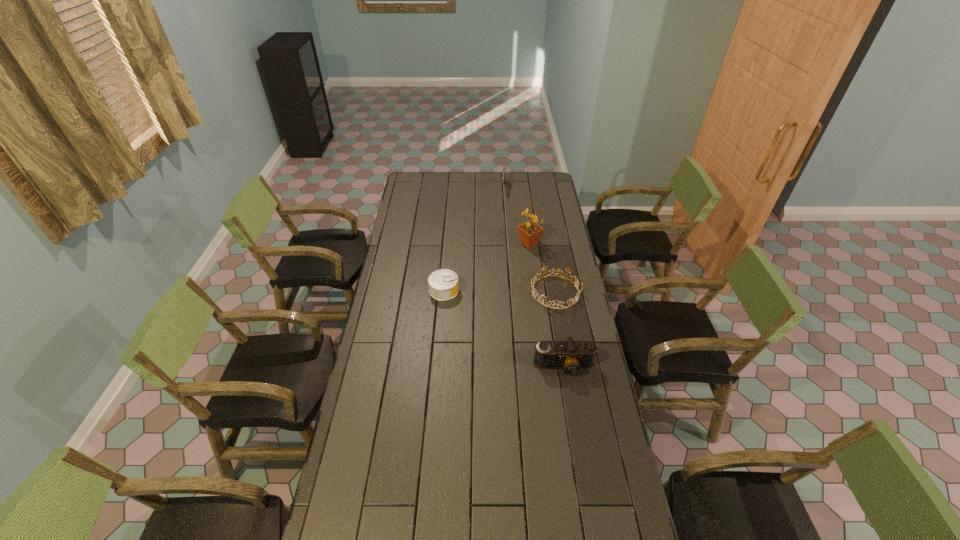
You are a GUI agent. You are given a task and a screenshot of the screen. Output one action in this format:
    pyautogui.click(x=<x>, y=<y>)
    Task: Click on the free region located 0.260m at the barrel of the pistol
    This screenshot has height=540, width=960.
    Given the screenshot: What is the action you would take?
    pyautogui.click(x=501, y=221)

Locate an element on the screen. This screenshot has width=960, height=540. vacant space located at the barrel of the pistol is located at coordinates (501, 222).

This screenshot has width=960, height=540. What are the coordinates of `free space located on the front-facing side of the tiara` in the screenshot? It's located at (513, 340).

Find the location of `blank space located 0.400m on the front-facing side of the tiara`. blank space located 0.400m on the front-facing side of the tiara is located at coordinates (491, 366).

In order to click on free region located 0.260m on the front-facing side of the tiara in this screenshot , I will do `click(510, 343)`.

At what (x,y) coordinates should I click in order to perform the action: click on vacant space located 0.260m at the front of the tallest object with flowers visible. Please return your answer as a coordinate pair (x, y). Looking at the image, I should click on (523, 286).

Find the location of a particular element. Image resolution: width=960 pixels, height=540 pixels. blank space located 0.400m at the front of the tallest object with flowers visible is located at coordinates (520, 308).

Identify the location of vacant space situated 0.220m at the front of the tallest object with flowers visible. (524, 280).

Find the location of a particular element. This screenshot has width=960, height=540. object present at the far edge is located at coordinates (504, 168).

The image size is (960, 540). Identify the location of camera that is at the right edge. (571, 356).